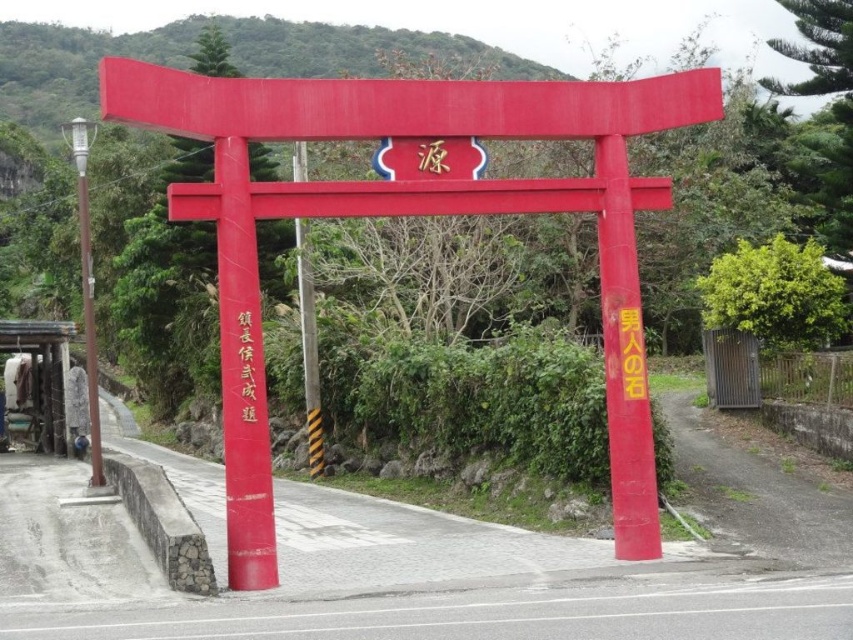
Is point (431, 129) behind point (308, 330)?

No.

Can you confirm if matte red torii gate at center is smaller than yellow-black striped pole at center?

Actually, matte red torii gate at center might be larger than yellow-black striped pole at center.

Is point (252, 572) positioned in front of point (305, 284)?

That is True.

Locate an element on the screen. The image size is (853, 640). matte red torii gate at center is located at coordinates click(x=416, y=214).

Is matte red torii gate at center smaller than brushed gold characters at center?

No, matte red torii gate at center is not smaller than brushed gold characters at center.

Between matte red torii gate at center and brushed gold characters at center, which one appears on the left side from the viewer's perspective?

brushed gold characters at center is more to the left.

The width and height of the screenshot is (853, 640). Find the location of `matte red torii gate at center`. matte red torii gate at center is located at coordinates (416, 214).

Can you confirm if yellow-black striped pole at center is wider than brushed gold characters at center?

Correct, the width of yellow-black striped pole at center exceeds that of brushed gold characters at center.

Can you confirm if yellow-black striped pole at center is positioned to the right of brushed gold characters at center?

No, yellow-black striped pole at center is not to the right of brushed gold characters at center.

What do you see at coordinates (309, 353) in the screenshot?
I see `yellow-black striped pole at center` at bounding box center [309, 353].

Where is `yellow-black striped pole at center`? The height and width of the screenshot is (640, 853). yellow-black striped pole at center is located at coordinates (309, 353).